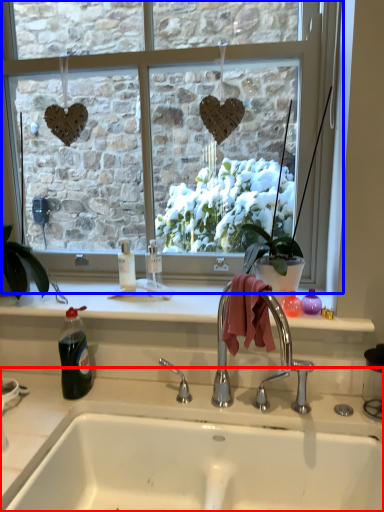
Question: Among these objects, which one is farthest to the camera, countertop (highlighted by a red box) or window (highlighted by a blue box)?

Choices:
 (A) countertop
 (B) window

Answer: (B)